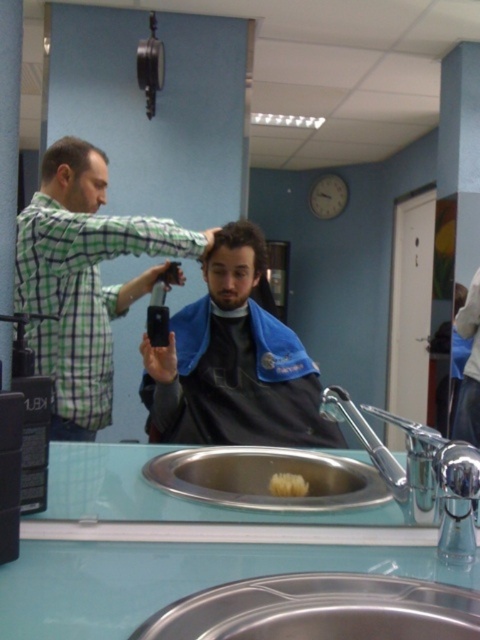
Is green checkered shirt at upper left smaller than chrome metallic faucet at sink right?

No.

Does green checkered shirt at upper left lie in front of chrome metallic faucet at sink right?

No.

Which is in front, point (108, 324) or point (406, 484)?

Point (406, 484) is more forward.

Where is `green checkered shirt at upper left`? green checkered shirt at upper left is located at coordinates (83, 280).

Is point (217, 440) closer to camera compared to point (233, 230)?

That is True.

Identify the location of matte black phone at center. This screenshot has width=480, height=640. (233, 362).

Find the location of `matte black phone at center`. matte black phone at center is located at coordinates (233, 362).

Is matte black phone at center wider than dark blue fabric at center?

Yes, matte black phone at center is wider than dark blue fabric at center.

Locate an element on the screen. The height and width of the screenshot is (640, 480). matte black phone at center is located at coordinates (233, 362).

Is point (147, 355) farther from camera compared to point (474, 324)?

No, (147, 355) is closer to viewer.

Locate an element on the screen. The image size is (480, 640). matte black phone at center is located at coordinates (233, 362).